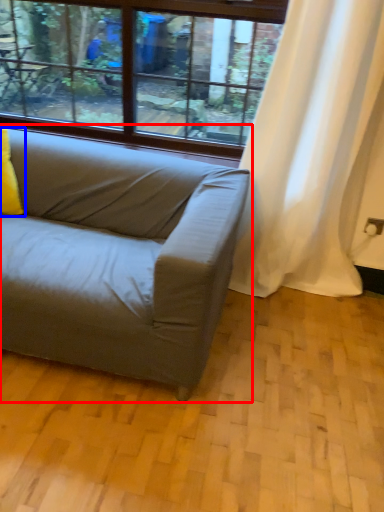
Question: Which object is further to the camera taking this photo, studio couch (highlighted by a red box) or pillow (highlighted by a blue box)?

Choices:
 (A) studio couch
 (B) pillow

Answer: (B)